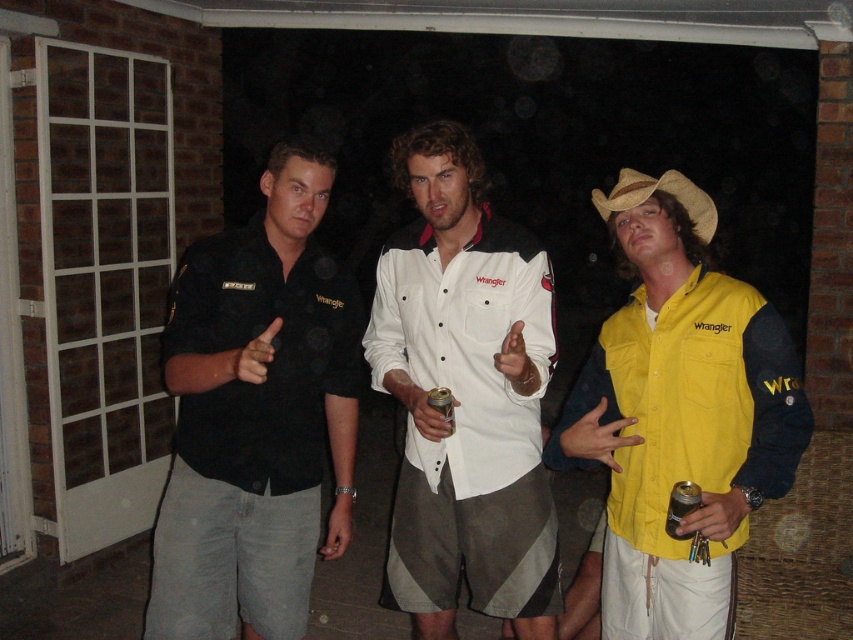
You are a photographer setting up a tripod in front of the scene. You need to ensure that the white cotton shirt at center and the metallic gold can at center are both visible in the frame. Which object should you prioritize positioning closer to the edge of the frame to avoid overcrowding?

The metallic gold can at center should be positioned closer to the edge of the frame because it is narrower than the white cotton shirt at center, making it easier to adjust without overcrowding the frame.

You are a photographer setting up a shot of the scene described. You want to place a new object between the white cotton shirt at center and the metallic gold can at center. Is there enough space to fit an object that is 10 cm wide?

The white cotton shirt at center is to the left of the metallic gold can at center. Since the distance between them isn

You are a photographer trying to capture a clear shot of the yellow fabric shirt at right and the strawhat at center. Which object should you focus on first to ensure it appears sharp in the photo?

The yellow fabric shirt at right is in front of the strawhat at center, so you should focus on the yellow fabric shirt at right first to ensure it appears sharp in the photo.